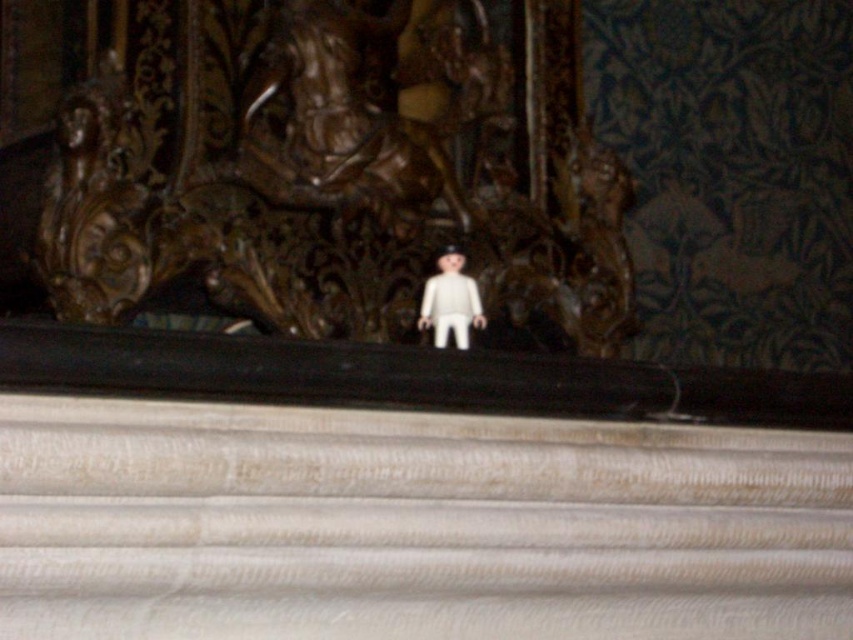
You are a museum curator arranging an exhibit. You have a white plastic doll at center and a brown wood carving at center. Which object is closer to the front of the display?

The brown wood carving at center is closer to the front of the display because the white plastic doll at center is positioned behind it.

You are a toy collector who wants to display the brown wood carving at center and the white plastic doll at center on a shelf. Which object should be placed at the back to avoid blocking the view of the smaller one?

The brown wood carving at center is taller than the white plastic doll at center, so the brown wood carving at center should be placed at the back to avoid blocking the view of the smaller white plastic doll at center.